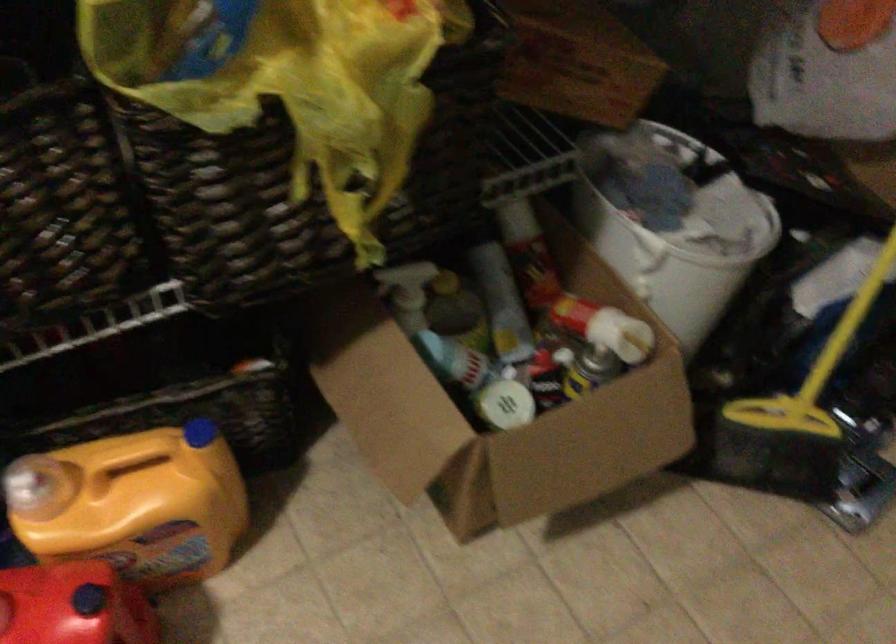
Identify the location of red container handle. Image resolution: width=896 pixels, height=644 pixels. (133, 504).